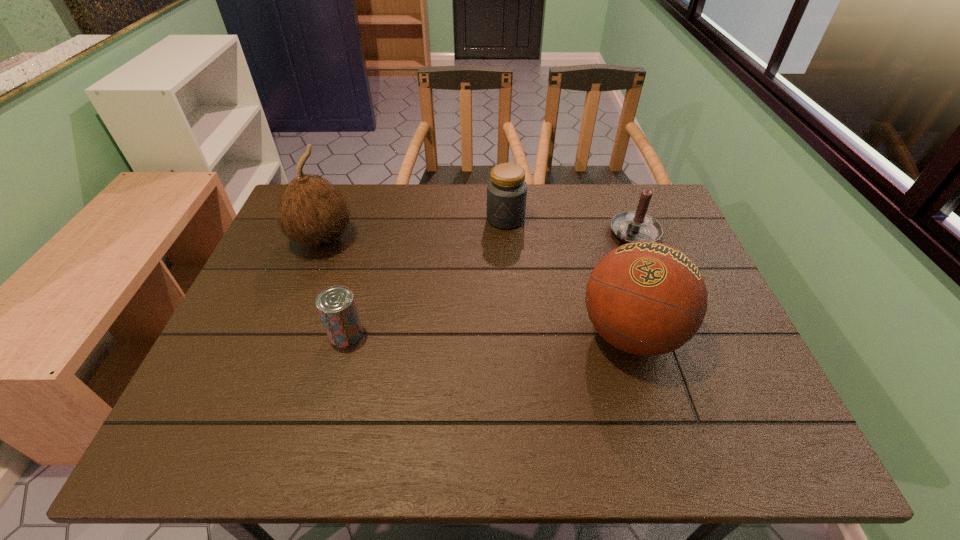
Where is `object that is the fourth closest to the candle`? This screenshot has height=540, width=960. object that is the fourth closest to the candle is located at coordinates (311, 210).

Locate an element on the screen. object that is the third closest to the coconut is located at coordinates (646, 298).

What are the coordinates of `vacant area in the image that satisfies the following two spatial constraints: 1. on the back side of the shortest object; 2. on the left side of the candle` in the screenshot? It's located at (373, 232).

You are a GUI agent. You are given a task and a screenshot of the screen. Output one action in this format:
    pyautogui.click(x=<x>, y=<y>)
    Task: Click on the vacant space that satisfies the following two spatial constraints: 1. on the front side of the basketball; 2. on the left side of the leftmost object
    The height and width of the screenshot is (540, 960).
    Given the screenshot: What is the action you would take?
    pyautogui.click(x=286, y=334)